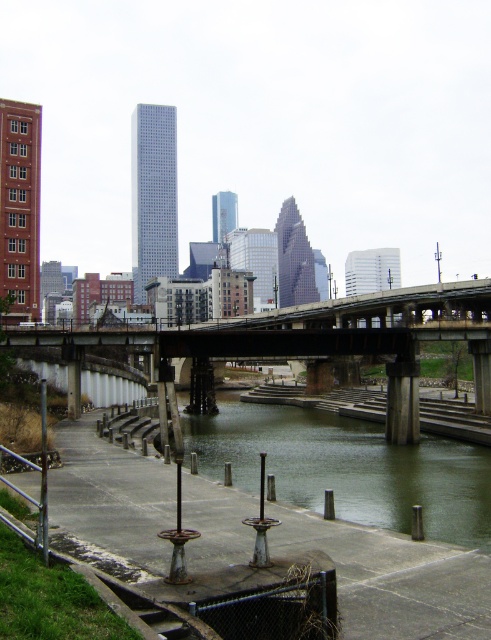
Which of these two, green concrete river at center or concrete bridge at center, stands taller?

Standing taller between the two is concrete bridge at center.

Who is positioned more to the right, green concrete river at center or concrete bridge at center?

Positioned to the right is concrete bridge at center.

Where is `green concrete river at center`? green concrete river at center is located at coordinates (349, 467).